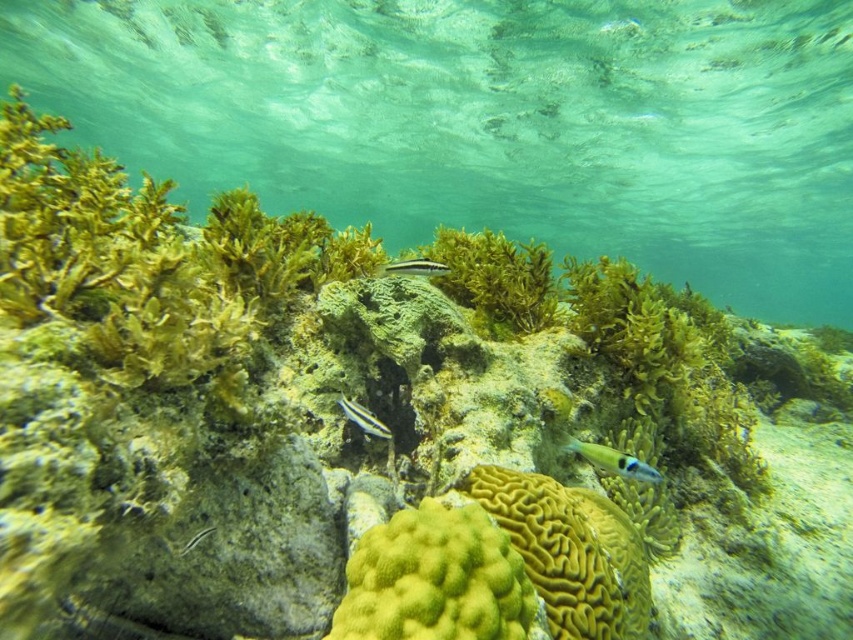
Question: Estimate the real-world distances between objects in this image. Which object is closer to the clear water at center?

Choices:
 (A) yellow brain coral at center
 (B) translucent blue fish at center

Answer: (A)

Question: Considering the real-world distances, which object is closest to the yellow brain coral at center?

Choices:
 (A) clear water at center
 (B) black glossy fish at center
 (C) yellow coral at center

Answer: (C)

Question: Is yellow coral at center below translucent blue fish at center?

Choices:
 (A) yes
 (B) no

Answer: (A)

Question: Can you confirm if clear water at center is bigger than yellow coral at center?

Choices:
 (A) yes
 (B) no

Answer: (A)

Question: Is clear water at center wider than shiny silver fish at center?

Choices:
 (A) no
 (B) yes

Answer: (B)

Question: Which point is farther to the camera?

Choices:
 (A) translucent blue fish at center
 (B) green matte algae at center
 (C) shiny silver fish at center

Answer: (B)